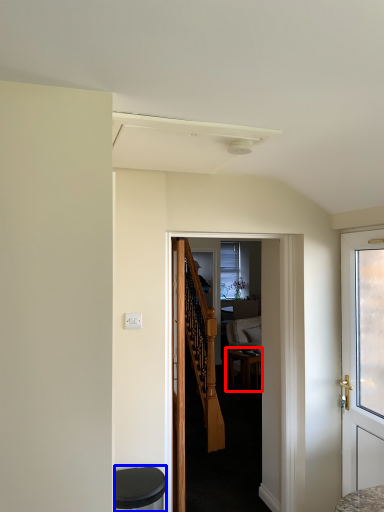
Question: Which point is further to the camera, desk (highlighted by a red box) or music stool (highlighted by a blue box)?

Choices:
 (A) desk
 (B) music stool

Answer: (A)